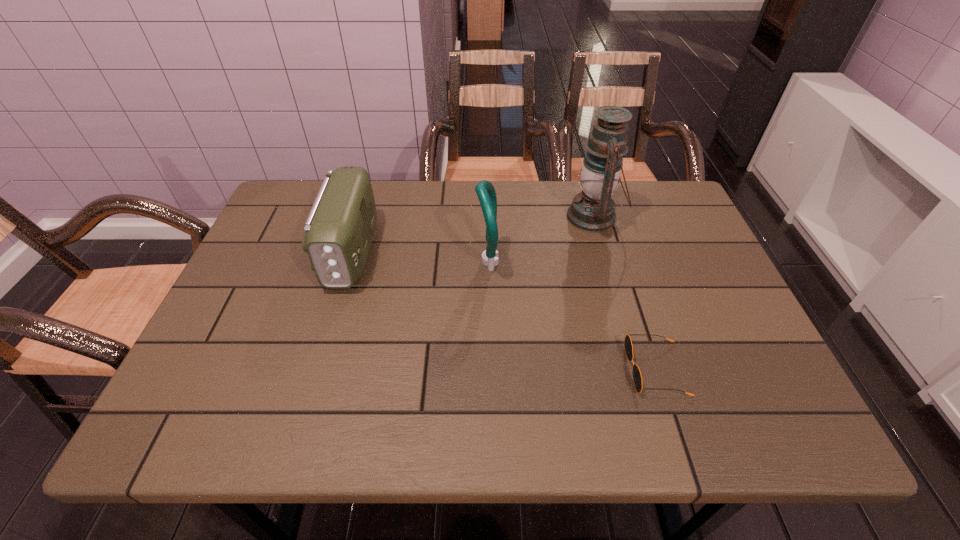
Image resolution: width=960 pixels, height=540 pixels. In order to click on vacant area situated at the jaws of the second object from left to right in this screenshot , I will do `click(321, 261)`.

Where is `free spot located on the front-facing side of the radio_receiver`? free spot located on the front-facing side of the radio_receiver is located at coordinates (333, 314).

This screenshot has height=540, width=960. I want to click on free location located 0.230m on the front-facing side of the sunglasses, so click(x=516, y=369).

I want to click on vacant region located on the front-facing side of the sunglasses, so click(x=585, y=369).

At what (x,y) coordinates should I click in order to perform the action: click on free space located 0.300m on the front-facing side of the sunglasses. Please return your answer as a coordinate pair (x, y). Looking at the image, I should click on (483, 369).

Locate an element on the screen. oil lamp situated at the far edge is located at coordinates (593, 210).

Identify the location of radio_receiver present at the far edge. The image size is (960, 540). (339, 228).

Identify the location of object positioned at the near edge. click(637, 378).

The height and width of the screenshot is (540, 960). I want to click on free space at the far edge of the desktop, so click(441, 188).

Image resolution: width=960 pixels, height=540 pixels. In the image, there is a desktop. Find the location of `vacant space at the near edge`. vacant space at the near edge is located at coordinates (276, 403).